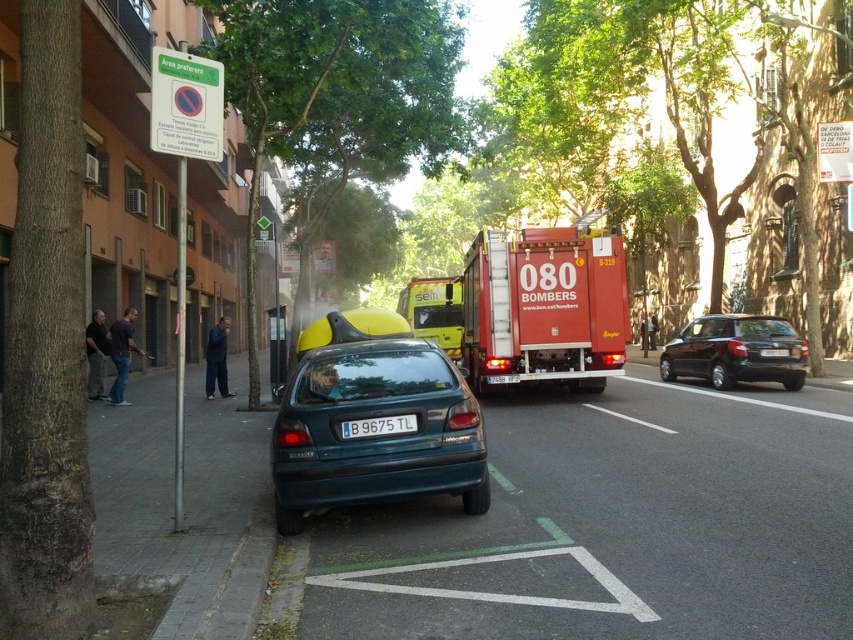
You are standing at point (553, 244) and want to walk to point (405, 492). Which direction should you move relative to your current position?

You should move forward because point (405, 492) is in front of point (553, 244).

You are a delivery person trying to park your teal matte hatchback at center in the preferential area. The signpost says you must be within 20 feet to qualify. Can you confirm if you are within the required distance?

The teal matte hatchback at center and the signpost are 19.73 feet apart, which is within the 20 feet requirement. Therefore, you qualify for the preferential area.